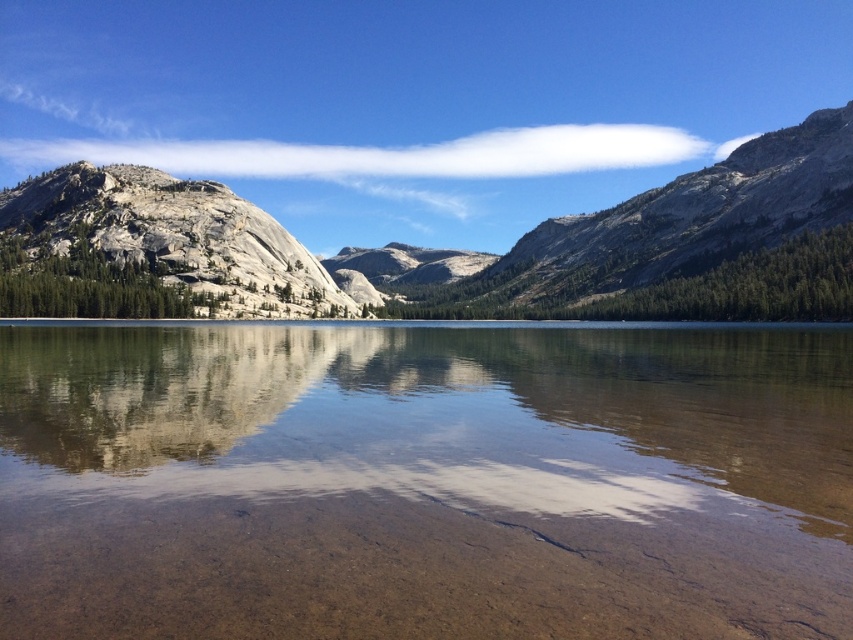
Question: Estimate the real-world distances between objects in this image. Which object is farther from the granite mountain at left?

Choices:
 (A) clear water at center
 (B) smooth stone mountain at center

Answer: (A)

Question: Does granite mountain at center have a lesser width compared to smooth stone mountain at center?

Choices:
 (A) yes
 (B) no

Answer: (B)

Question: Does clear water at center have a smaller size compared to granite mountain at left?

Choices:
 (A) no
 (B) yes

Answer: (B)

Question: Which is nearer to the granite mountain at left?

Choices:
 (A) granite mountain at center
 (B) smooth stone mountain at center

Answer: (A)

Question: Which object appears farthest from the camera in this image?

Choices:
 (A) smooth stone mountain at center
 (B) clear water at center

Answer: (A)

Question: Does clear water at center appear under smooth stone mountain at center?

Choices:
 (A) no
 (B) yes

Answer: (B)